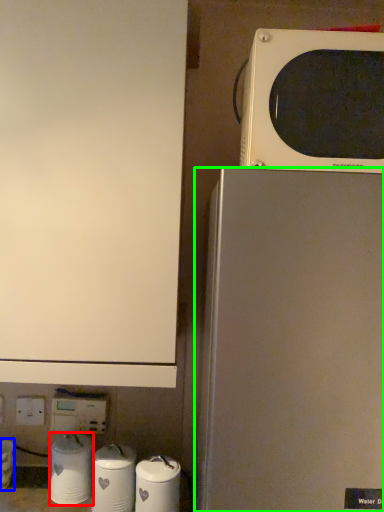
Question: Considering the real-world distances, which object is closest to appliance (highlighted by a red box)? appliance (highlighted by a blue box) or refrigerator (highlighted by a green box).

Choices:
 (A) appliance
 (B) refrigerator

Answer: (A)